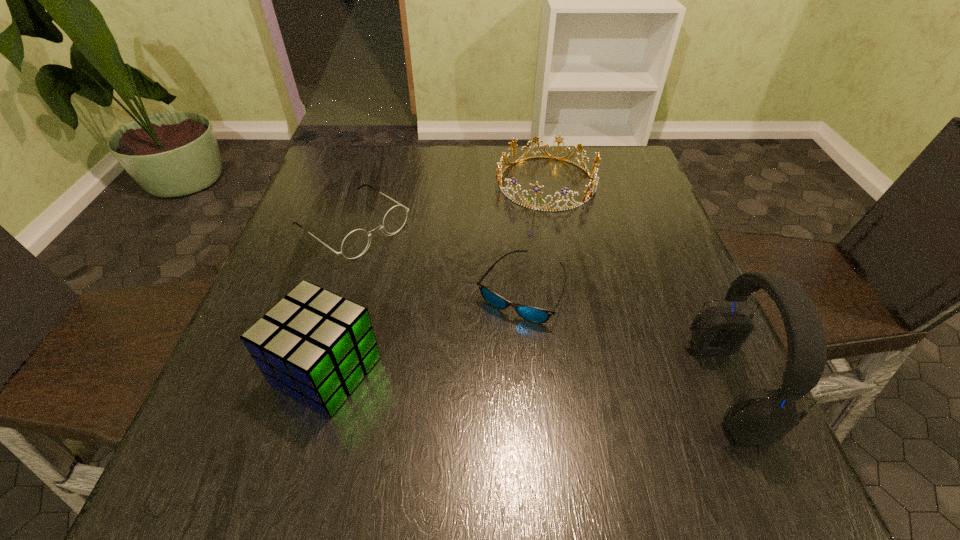
You are a GUI agent. You are given a task and a screenshot of the screen. Output one action in this format:
    pyautogui.click(x=<x>, y=<y>)
    Task: Click on the free spot located on the front-facing side of the spectacles
    The width and height of the screenshot is (960, 540).
    Given the screenshot: What is the action you would take?
    pyautogui.click(x=455, y=297)

Identify the location of blank space located on the front-facing side of the spectacles. The image size is (960, 540). (448, 292).

In order to click on free space located on the front-facing side of the spectacles in this screenshot , I will do `click(415, 269)`.

Find the location of `free space located at the front of the shortest object showing the lenses`. free space located at the front of the shortest object showing the lenses is located at coordinates (547, 393).

Identify the location of vacant space situated at the front of the shortest object showing the lenses. The image size is (960, 540). (543, 377).

Find the location of a particular element. The width and height of the screenshot is (960, 540). vacant space located 0.180m at the front of the shortest object showing the lenses is located at coordinates (553, 415).

Locate an element on the screen. This screenshot has height=540, width=960. tiara present at the far edge is located at coordinates (594, 180).

The height and width of the screenshot is (540, 960). Identify the location of spectacles that is positioned at the far edge. (355, 243).

Identify the location of cube that is positioned at the near edge. Image resolution: width=960 pixels, height=540 pixels. (316, 346).

I want to click on headset that is at the near edge, so click(757, 417).